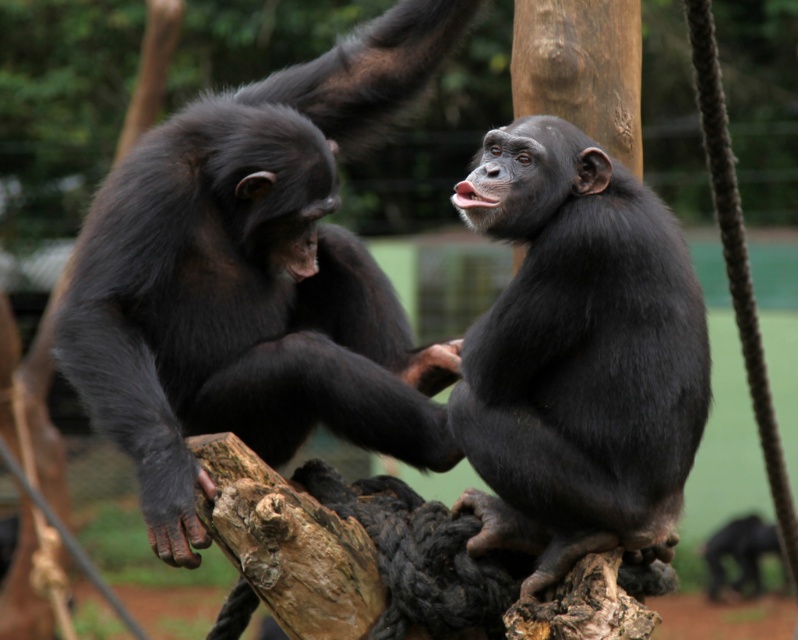
Question: Does shiny black monkey at upper right have a greater width compared to shiny black monkey at center?

Choices:
 (A) no
 (B) yes

Answer: (B)

Question: Can you confirm if shiny black monkey at upper right is thinner than shiny black monkey at center?

Choices:
 (A) yes
 (B) no

Answer: (B)

Question: Does shiny black monkey at upper right come in front of shiny black monkey at center?

Choices:
 (A) yes
 (B) no

Answer: (B)

Question: Which of the following is the farthest from the observer?

Choices:
 (A) (216, 317)
 (B) (618, 208)

Answer: (A)